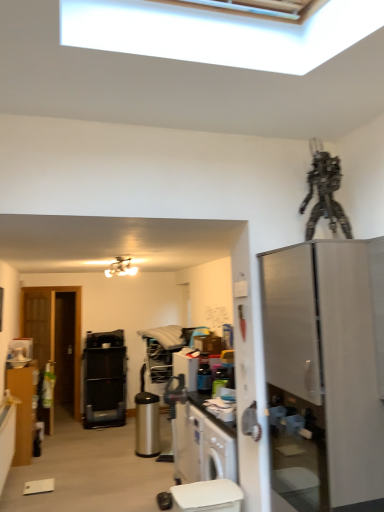
Question: Considering the relative positions of transparent glass door at left and matte brown cabinet at left in the image provided, is transparent glass door at left to the left or to the right of matte brown cabinet at left?

Choices:
 (A) left
 (B) right

Answer: (A)

Question: From a real-world perspective, relative to matte brown cabinet at left, is transparent glass door at left vertically above or below?

Choices:
 (A) above
 (B) below

Answer: (A)

Question: Considering the real-world distances, which object is closest to the stainless steel refrigerator at right?

Choices:
 (A) matte brown cabinet at left
 (B) black mesh speaker at center, which ranks as the 1th appliance in left-to-right order
 (C) transparent glass door at left
 (D) polished stainless steel trash can at center, which is counted as the 2th appliance, starting from the front
 (E) metallic robot at upper right

Answer: (E)

Question: Which is nearer to the metallic silver toaster at center, placed as the 1th appliance when sorted from front to back?

Choices:
 (A) stainless steel refrigerator at right
 (B) white matte light fixture at upper center
 (C) black mesh speaker at center, which ranks as the 1th appliance in left-to-right order
 (D) metallic robot at upper right
 (E) transparent glass door at left

Answer: (B)